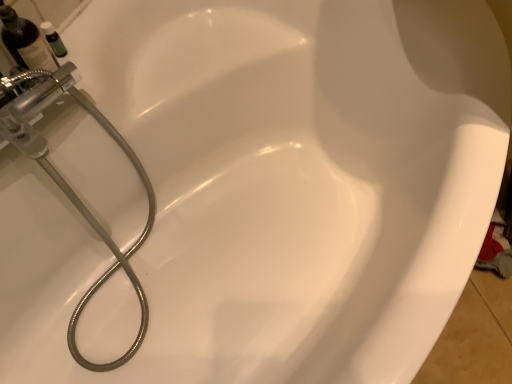
The image size is (512, 384). What do you see at coordinates (25, 41) in the screenshot?
I see `matte black bottle at upper left` at bounding box center [25, 41].

The image size is (512, 384). Find the location of `brushed metal showerhead at left`. brushed metal showerhead at left is located at coordinates (70, 187).

The height and width of the screenshot is (384, 512). Identify the location of green glass bottle at upper left. (53, 39).

Locate an element on the screen. matte black bottle at upper left is located at coordinates (25, 41).

In the image, is brushed metal showerhead at left on the left side or the right side of green glass bottle at upper left?

brushed metal showerhead at left is to the right of green glass bottle at upper left.

From a real-world perspective, who is located higher, brushed metal showerhead at left or green glass bottle at upper left?

green glass bottle at upper left is physically above.

Based on the photo, considering the relative sizes of brushed metal showerhead at left and green glass bottle at upper left in the image provided, is brushed metal showerhead at left thinner than green glass bottle at upper left?

No.

From the image's perspective, which one is positioned lower, green glass bottle at upper left or brushed metal showerhead at left?

brushed metal showerhead at left, from the image's perspective.

What's the angular difference between green glass bottle at upper left and brushed metal showerhead at left's facing directions?

The angle between the facing direction of green glass bottle at upper left and the facing direction of brushed metal showerhead at left is 5.01 degrees.

Is green glass bottle at upper left positioned before brushed metal showerhead at left?

No, green glass bottle at upper left is further to the viewer.

In terms of height, does matte black bottle at upper left look taller or shorter compared to green glass bottle at upper left?

Clearly, matte black bottle at upper left is taller compared to green glass bottle at upper left.

Is matte black bottle at upper left oriented towards green glass bottle at upper left?

No, matte black bottle at upper left is not aimed at green glass bottle at upper left.

From the image's perspective, between matte black bottle at upper left and green glass bottle at upper left, which one is located above?

green glass bottle at upper left appears higher in the image.

Which object is more forward, matte black bottle at upper left or green glass bottle at upper left?

matte black bottle at upper left is in front.

Image resolution: width=512 pixels, height=384 pixels. Find the location of `toiletry on the right side of matte black bottle at upper left`. toiletry on the right side of matte black bottle at upper left is located at coordinates (53, 39).

Which of these two, green glass bottle at upper left or matte black bottle at upper left, stands shorter?

green glass bottle at upper left.

From the image's perspective, which is below, green glass bottle at upper left or matte black bottle at upper left?

matte black bottle at upper left, from the image's perspective.

Can you confirm if green glass bottle at upper left is wider than matte black bottle at upper left?

No, green glass bottle at upper left is not wider than matte black bottle at upper left.

Which is correct: matte black bottle at upper left is inside brushed metal showerhead at left, or outside of it?

matte black bottle at upper left is spatially situated outside brushed metal showerhead at left.

From the image's perspective, is matte black bottle at upper left positioned above or below brushed metal showerhead at left?

matte black bottle at upper left is situated higher than brushed metal showerhead at left in the image.

From a real-world perspective, does matte black bottle at upper left stand above brushed metal showerhead at left?

Correct, in the physical world, matte black bottle at upper left is higher than brushed metal showerhead at left.

Considering the relative sizes of matte black bottle at upper left and brushed metal showerhead at left in the image provided, is matte black bottle at upper left thinner than brushed metal showerhead at left?

Yes.

Does brushed metal showerhead at left have a lesser width compared to matte black bottle at upper left?

No.

Is brushed metal showerhead at left spatially inside matte black bottle at upper left, or outside of it?

brushed metal showerhead at left is outside matte black bottle at upper left.

Looking at the image, does brushed metal showerhead at left seem bigger or smaller compared to matte black bottle at upper left?

In the image, brushed metal showerhead at left appears to be larger than matte black bottle at upper left.

Locate an element on the screen. plumbing fixture located below the green glass bottle at upper left (from the image's perspective) is located at coordinates click(x=70, y=187).

Find the location of a particular element. plumbing fixture beneath the green glass bottle at upper left (from a real-world perspective) is located at coordinates (70, 187).

Which object lies further to the anchor point brushed metal showerhead at left, green glass bottle at upper left or matte black bottle at upper left?

Based on the image, green glass bottle at upper left appears to be further to brushed metal showerhead at left.

When comparing their distances from matte black bottle at upper left, does green glass bottle at upper left or brushed metal showerhead at left seem closer?

Based on the image, green glass bottle at upper left appears to be nearer to matte black bottle at upper left.

Consider the image. When comparing their distances from matte black bottle at upper left, does brushed metal showerhead at left or green glass bottle at upper left seem further?

Based on the image, brushed metal showerhead at left appears to be further to matte black bottle at upper left.

Looking at the image, which one is located closer to brushed metal showerhead at left, matte black bottle at upper left or green glass bottle at upper left?

Based on the image, matte black bottle at upper left appears to be nearer to brushed metal showerhead at left.

Consider the image. Considering their positions, is matte black bottle at upper left positioned further to green glass bottle at upper left than brushed metal showerhead at left?

Based on the image, brushed metal showerhead at left appears to be further to green glass bottle at upper left.

Looking at the image, which one is located further to green glass bottle at upper left, brushed metal showerhead at left or matte black bottle at upper left?

brushed metal showerhead at left is further to green glass bottle at upper left.

This screenshot has height=384, width=512. I want to click on bottle between green glass bottle at upper left and brushed metal showerhead at left vertically, so click(x=25, y=41).